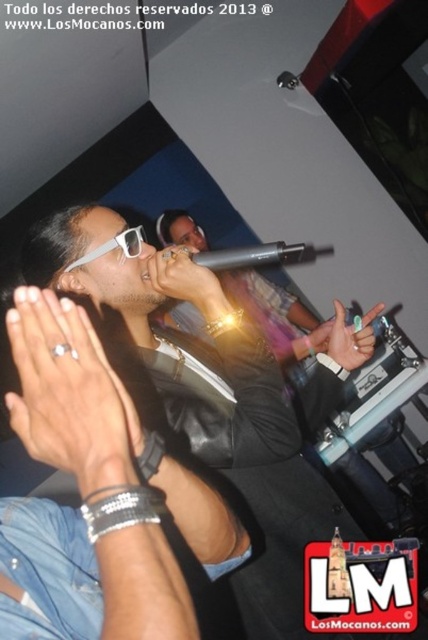
Which is in front, point (344, 332) or point (291, 253)?

Point (291, 253) is more forward.

Who is lower down, green matte ring at center or black matte microphone at center?

Positioned lower is green matte ring at center.

Locate an element on the screen. The height and width of the screenshot is (640, 428). green matte ring at center is located at coordinates (351, 337).

In the scene shown: Is green matte ring at center thinner than white plastic sunglasses at center?

No.

This screenshot has height=640, width=428. What do you see at coordinates (351, 337) in the screenshot?
I see `green matte ring at center` at bounding box center [351, 337].

Is point (345, 362) positioned after point (125, 237)?

Yes, it is.

Where is `green matte ring at center`? This screenshot has height=640, width=428. green matte ring at center is located at coordinates (351, 337).

Which is in front, point (261, 244) or point (133, 248)?

Point (261, 244) is in front.

Is black matte microphone at center wider than white plastic sunglasses at center?

Correct, the width of black matte microphone at center exceeds that of white plastic sunglasses at center.

Where is `black matte microphone at center`? black matte microphone at center is located at coordinates (247, 256).